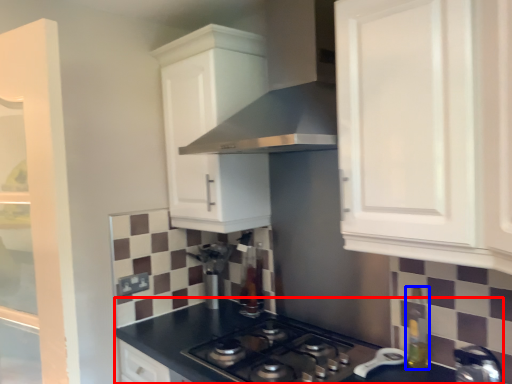
Question: Which object is closer to the camera taking this photo, countertop (highlighted by a red box) or bottle (highlighted by a blue box)?

Choices:
 (A) countertop
 (B) bottle

Answer: (A)